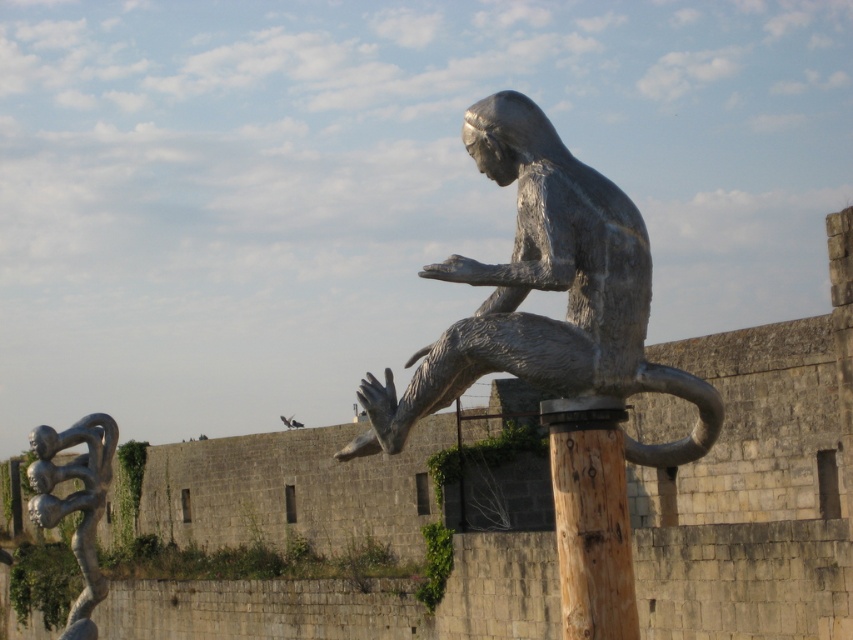
Question: Can you confirm if brown wood pole at center is positioned above polished silver figure at lower left?

Choices:
 (A) yes
 (B) no

Answer: (A)

Question: Which point is closer to the camera?

Choices:
 (A) brown wood pole at center
 (B) polished bronze statue at center

Answer: (B)

Question: Which object is closer to the camera taking this photo?

Choices:
 (A) polished silver figure at lower left
 (B) polished bronze statue at center
 (C) brown wood pole at center

Answer: (B)

Question: Among these objects, which one is farthest from the camera?

Choices:
 (A) polished bronze statue at center
 (B) brown wood pole at center

Answer: (B)

Question: In this image, where is polished bronze statue at center located relative to polished silver figure at lower left?

Choices:
 (A) right
 (B) left

Answer: (A)

Question: Is polished bronze statue at center bigger than polished silver figure at lower left?

Choices:
 (A) no
 (B) yes

Answer: (A)